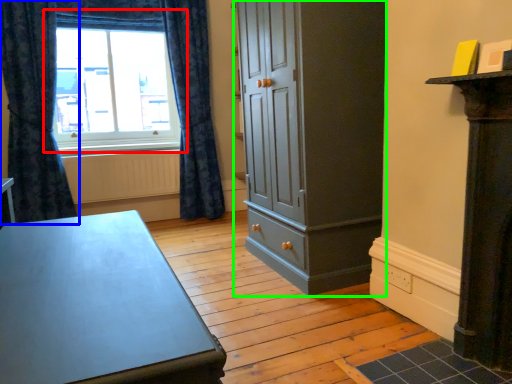
Question: Which object is the closest to the window (highlighted by a red box)? Choose among these: curtain (highlighted by a blue box) or cupboard (highlighted by a green box).

Choices:
 (A) curtain
 (B) cupboard

Answer: (A)